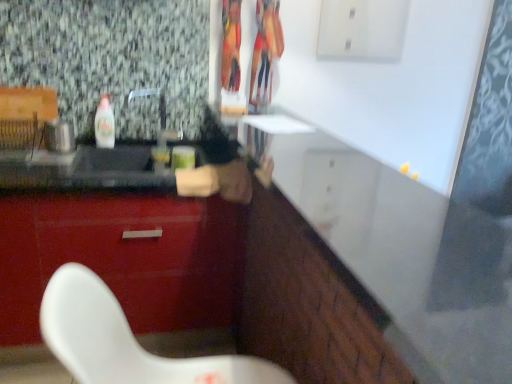
In order to face white glossy counter at center, should I rotate leftwards or rightwards?

Rotate your view right by about 6.911°.

This screenshot has height=384, width=512. Describe the element at coordinates (104, 124) in the screenshot. I see `clear plastic bottle at left` at that location.

What is the approximate width of glossy red cabinet at lower left?

It is 29.87 inches.

You are a GUI agent. You are given a task and a screenshot of the screen. Output one action in this format:
    pyautogui.click(x=<x>, y=<y>)
    Task: Click on the white glossy counter at center
    The height and width of the screenshot is (384, 512).
    Given the screenshot: What is the action you would take?
    pyautogui.click(x=400, y=251)

Which point is more distant from viewer, [121,223] or [416,304]?

Point [121,223]

Considering the sizes of objects glossy red cabinet at lower left and white glossy counter at center in the image provided, who is wider, glossy red cabinet at lower left or white glossy counter at center?

white glossy counter at center is wider.

Locate an element on the screen. cabinetry located below the white glossy counter at center (from the image's perspective) is located at coordinates (121, 257).

Can you confirm if glossy red cabinet at lower left is positioned to the right of white glossy counter at center?

No.

Considering the positions of point (45, 232) and point (95, 123), is point (45, 232) closer or farther from the camera than point (95, 123)?

Point (45, 232) is closer to the camera than point (95, 123).

Based on the photo, how far apart are glossy red cabinet at lower left and clear plastic bottle at left?

glossy red cabinet at lower left and clear plastic bottle at left are 69.67 centimeters apart from each other.

Looking at this image, is glossy red cabinet at lower left facing away from clear plastic bottle at left?

No.

Would you say clear plastic bottle at left is part of glossy red cabinet at lower left's contents?

Actually, clear plastic bottle at left is outside glossy red cabinet at lower left.

In the image, is clear plastic bottle at left positioned in front of or behind white glossy counter at center?

Visually, clear plastic bottle at left is located behind white glossy counter at center.

Are clear plastic bottle at left and white glossy counter at center beside each other?

No, clear plastic bottle at left is not in contact with white glossy counter at center.

Could you tell me if clear plastic bottle at left is turned towards white glossy counter at center?

No, clear plastic bottle at left is not aimed at white glossy counter at center.

In the scene shown: Is the position of white glossy counter at center less distant than that of clear plastic bottle at left?

Yes, white glossy counter at center is closer to the camera.

From the picture: Which of these two, white glossy counter at center or clear plastic bottle at left, is thinner?

clear plastic bottle at left is thinner.

From a real-world perspective, is white glossy counter at center over clear plastic bottle at left?

Yes, from a real-world perspective, white glossy counter at center is over clear plastic bottle at left

Which is correct: white glossy counter at center is inside glossy red cabinet at lower left, or outside of it?

white glossy counter at center is spatially situated outside glossy red cabinet at lower left.

What's the angular difference between white glossy counter at center and glossy red cabinet at lower left's facing directions?

0.314 degrees.

I want to click on counter located on the right of glossy red cabinet at lower left, so 400,251.

Are white glossy counter at center and glossy red cabinet at lower left located far from each other?

No, white glossy counter at center is not far from glossy red cabinet at lower left.

Is clear plastic bottle at left smaller than glossy red cabinet at lower left?

Correct, clear plastic bottle at left occupies less space than glossy red cabinet at lower left.

From the image's perspective, is clear plastic bottle at left on top of glossy red cabinet at lower left?

Indeed, from the image's perspective, clear plastic bottle at left is shown above glossy red cabinet at lower left.

Is glossy red cabinet at lower left surrounded by clear plastic bottle at left?

No, clear plastic bottle at left does not contain glossy red cabinet at lower left.

How many degrees apart are the facing directions of clear plastic bottle at left and glossy red cabinet at lower left?

clear plastic bottle at left and glossy red cabinet at lower left are facing 1.11 degrees away from each other.

Locate an element on the screen. This screenshot has height=384, width=512. counter lying above the glossy red cabinet at lower left (from the image's perspective) is located at coordinates (400, 251).

You are a GUI agent. You are given a task and a screenshot of the screen. Output one action in this format:
    pyautogui.click(x=<x>, y=<y>)
    Task: Click on the bottle behind the glossy red cabinet at lower left
    
    Given the screenshot: What is the action you would take?
    pyautogui.click(x=104, y=124)

Based on their spatial positions, is clear plastic bottle at left or white glossy counter at center further from glossy red cabinet at lower left?

white glossy counter at center is further to glossy red cabinet at lower left.

From the picture: From the image, which object appears to be nearer to clear plastic bottle at left, glossy red cabinet at lower left or white glossy counter at center?

glossy red cabinet at lower left lies closer to clear plastic bottle at left than the other object.

Based on their spatial positions, is glossy red cabinet at lower left or clear plastic bottle at left closer to white glossy counter at center?

glossy red cabinet at lower left is closer to white glossy counter at center.

From the image, which object appears to be farther from clear plastic bottle at left, white glossy counter at center or glossy red cabinet at lower left?

white glossy counter at center.

Based on their spatial positions, is white glossy counter at center or clear plastic bottle at left further from glossy red cabinet at lower left?

The object further to glossy red cabinet at lower left is white glossy counter at center.

Considering their positions, is clear plastic bottle at left positioned closer to white glossy counter at center than glossy red cabinet at lower left?

glossy red cabinet at lower left lies closer to white glossy counter at center than the other object.

At what (x,y) coordinates should I click in order to perform the action: click on cabinetry positioned between white glossy counter at center and clear plastic bottle at left from near to far. Please return your answer as a coordinate pair (x, y). The height and width of the screenshot is (384, 512). Looking at the image, I should click on (121, 257).